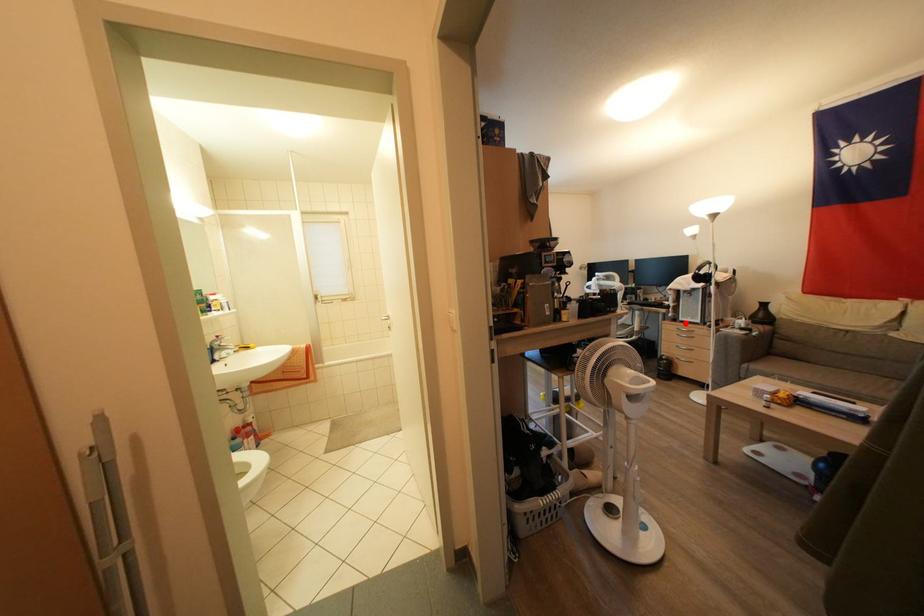
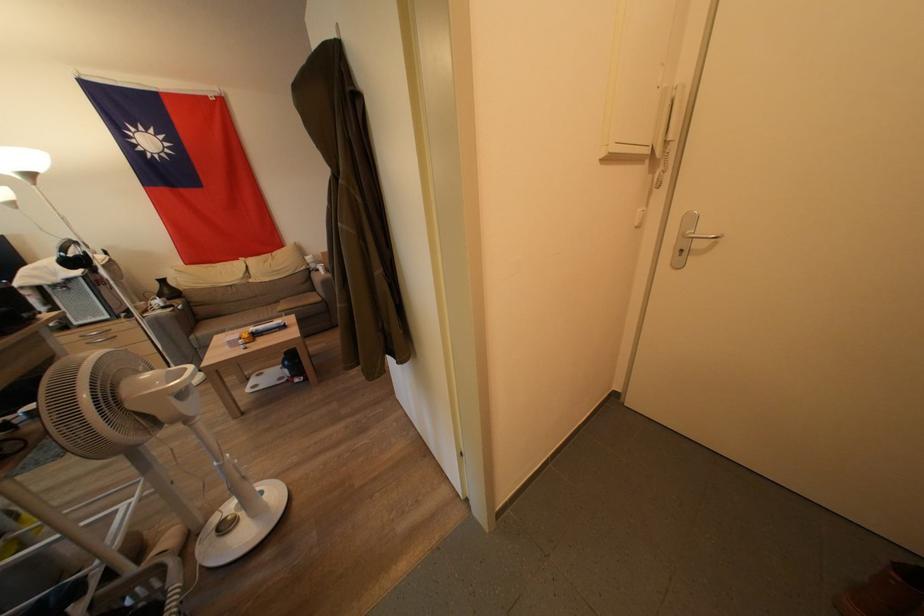
Question: I am providing you with two images of the same scene from different viewpoints. In image1, a red point is highlighted. Considering the same 3D point in image2, which of the following is correct?

Choices:
 (A) It is closer
 (B) It is farther

Answer: (B)